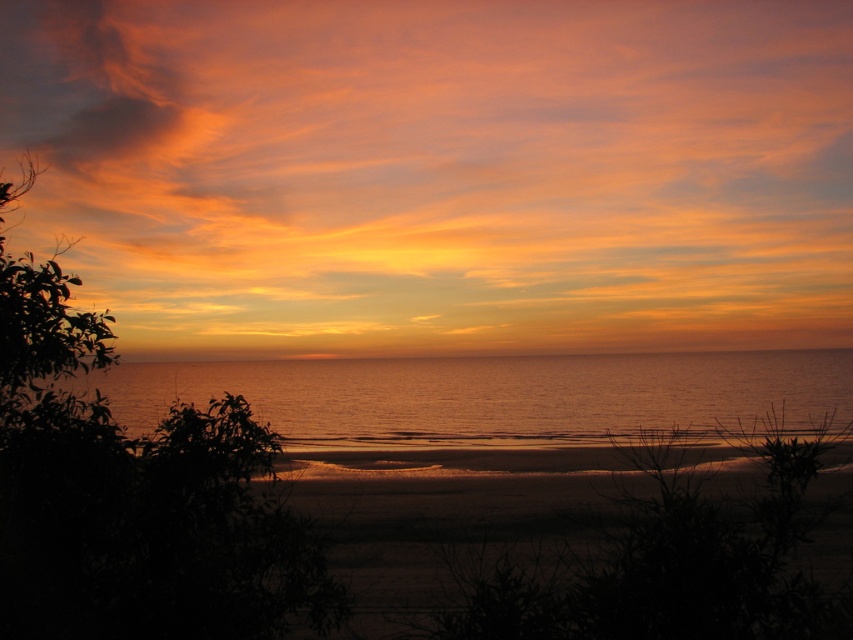
You are a photographer standing on the beach and want to capture the sunset. You notice the matte orange cloud at upper center and the silvery water at center. Which object is positioned higher in the sky?

The matte orange cloud at upper center is positioned higher in the sky than the silvery water at center because it is located above it.

You are a photographer trying to capture the sunset. You notice the matte orange cloud at upper center and the silvery water at center. Which object appears taller in the image?

The matte orange cloud at upper center is taller than the silvery water at center.

You are standing on the beach and looking at the sunset. You see the matte orange cloud at upper center and the silvery water at center. Which object is closer to you?

The matte orange cloud at upper center is closer to you because it is in front of the silvery water at center.